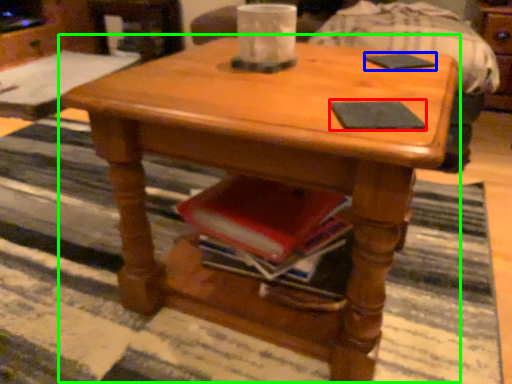
Question: Which object is the farthest from pad (highlighted by a red box)? Choose among these: pad (highlighted by a blue box) or coffee table (highlighted by a green box).

Choices:
 (A) pad
 (B) coffee table

Answer: (A)